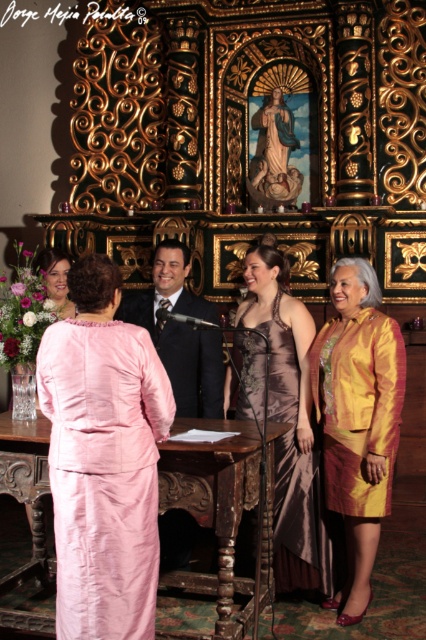
Question: Is matte pink altar at center bigger than shiny black suit at center?

Choices:
 (A) no
 (B) yes

Answer: (B)

Question: Estimate the real-world distances between objects in this image. Which object is farther from the pink silk dress at center?

Choices:
 (A) pink satin dress at lower left
 (B) shiny black suit at center
 (C) matte pink dress at lower left

Answer: (C)

Question: Does pink silk dress at center have a smaller size compared to matte pink dress at lower left?

Choices:
 (A) yes
 (B) no

Answer: (B)

Question: Which of these objects is positioned closest to the gold silk skirt at right?

Choices:
 (A) matte pink dress at lower left
 (B) satin dress at center
 (C) pink silk dress at center

Answer: (B)

Question: In this image, where is satin dress at center located relative to shiny black suit at center?

Choices:
 (A) below
 (B) above

Answer: (A)

Question: Which point is farther from the camera taking this photo?

Choices:
 (A) (155, 298)
 (B) (336, 352)

Answer: (A)